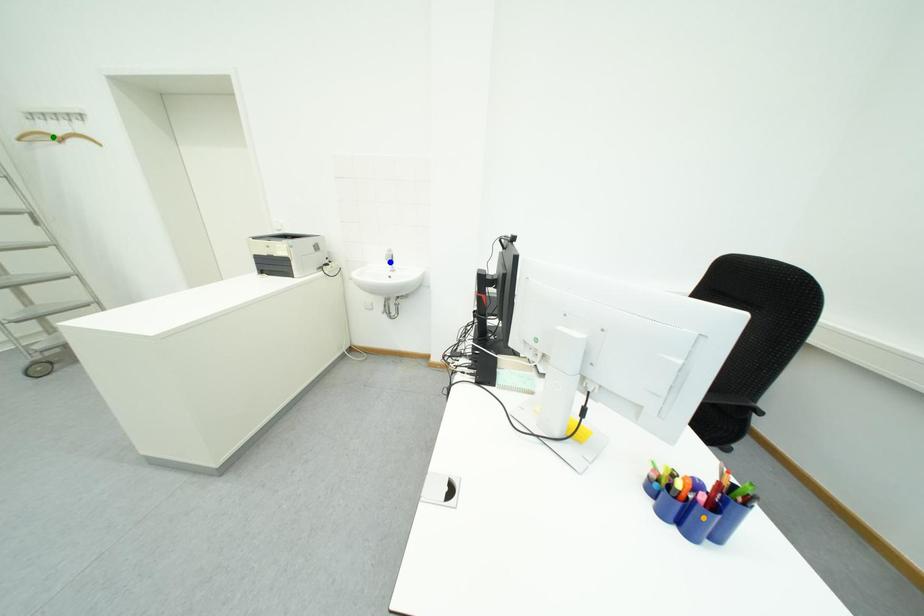
Looking at this image, order these from nearest to farthest:
blue point
orange point
green point

1. orange point
2. green point
3. blue point